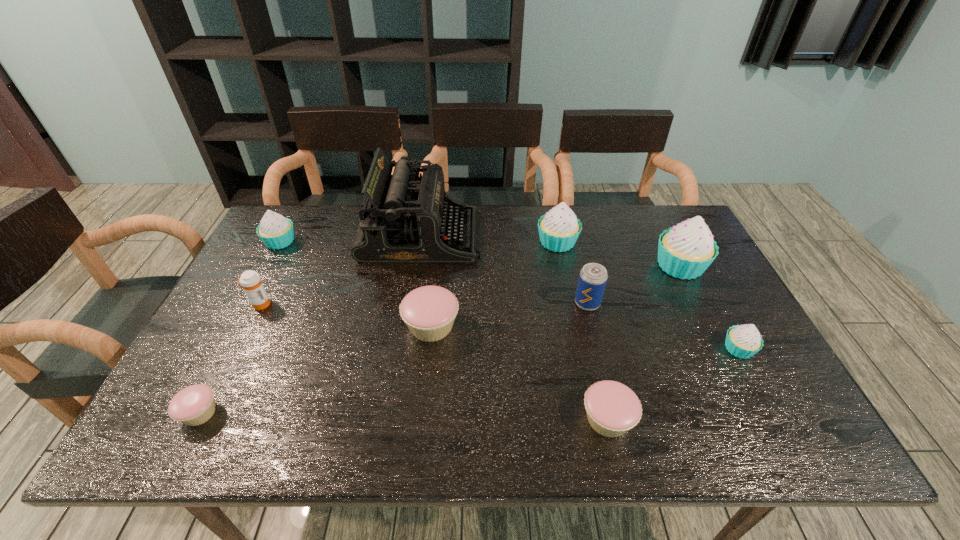
Where is `the farthest pink cupcake`? Image resolution: width=960 pixels, height=540 pixels. the farthest pink cupcake is located at coordinates (429, 312).

The height and width of the screenshot is (540, 960). What are the coordinates of `the nearest white cupcake` in the screenshot? It's located at (743, 341).

Image resolution: width=960 pixels, height=540 pixels. Identify the location of the rightmost pink cupcake. (612, 408).

Identify the location of the second smallest pink cupcake. The height and width of the screenshot is (540, 960). (612, 408).

The height and width of the screenshot is (540, 960). I want to click on the shortest object, so click(194, 405).

Locate an element on the screen. the leftmost pink cupcake is located at coordinates (194, 405).

I want to click on vacant area situated 0.320m on the keyboard of the typewriter, so click(x=578, y=235).

Where is `free region located 0.090m on the front of the tallest cupcake`? The width and height of the screenshot is (960, 540). free region located 0.090m on the front of the tallest cupcake is located at coordinates (701, 307).

This screenshot has height=540, width=960. Identify the location of vacant space located 0.130m on the right of the second white cupcake from left to right. (619, 242).

Identify the location of blank space located on the left of the beer can. The width and height of the screenshot is (960, 540). (451, 303).